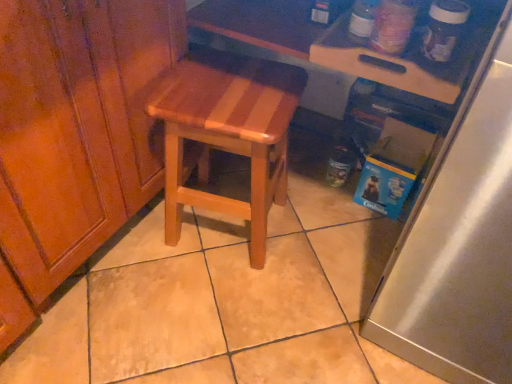
Where is `vacant point to the right of wooden at center`? This screenshot has width=512, height=384. vacant point to the right of wooden at center is located at coordinates (321, 239).